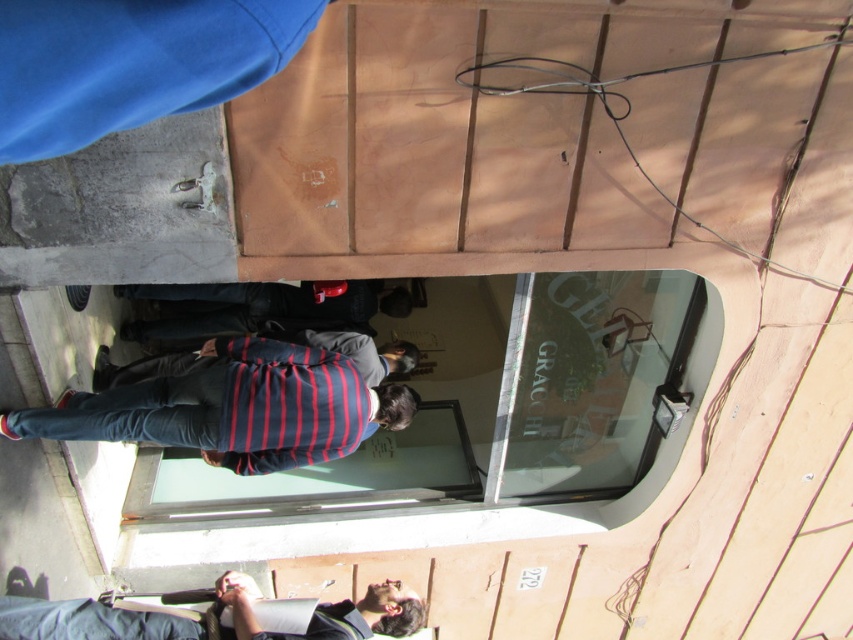
Does blue striped shirt at center lie behind striped fabric shirt at center?

No, blue striped shirt at center is closer to the viewer.

Which is more to the right, blue striped shirt at center or striped fabric shirt at center?

From the viewer's perspective, striped fabric shirt at center appears more on the right side.

Who is more forward, (355,614) or (360,364)?

Point (355,614) is in front.

Find the location of a particular element. blue striped shirt at center is located at coordinates (212, 616).

Between striped cotton shirt at center and blue striped shirt at center, which one is positioned lower?

Positioned lower is blue striped shirt at center.

Looking at this image, does striped cotton shirt at center appear over blue striped shirt at center?

Correct, striped cotton shirt at center is located above blue striped shirt at center.

Who is more distant from viewer, [236,346] or [61,614]?

Positioned behind is point [236,346].

Locate an element on the screen. This screenshot has width=853, height=640. striped cotton shirt at center is located at coordinates pyautogui.click(x=233, y=408).

Between striped cotton shirt at center and striped fabric shirt at center, which one is positioned higher?

striped fabric shirt at center is above.

Is point (341, 426) positioned in front of point (354, 348)?

Yes, it is.

Does point (308, 369) come behind point (198, 356)?

No, it is not.

Identify the location of striped cotton shirt at center. (233, 408).